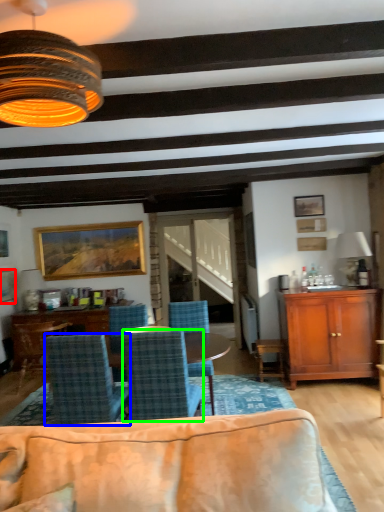
Question: Estimate the real-world distances between objects in this image. Which object is farther from picture frame (highlighted by a red box), chair (highlighted by a blue box) or chair (highlighted by a green box)?

Choices:
 (A) chair
 (B) chair

Answer: (B)